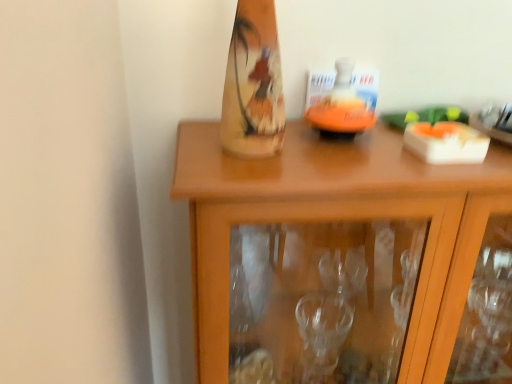
What is the approximate height of wooden cabinet at center?

wooden cabinet at center is 76.45 centimeters in height.

Locate an element on the screen. wooden cabinet at center is located at coordinates (339, 220).

What do you see at coordinates (339, 220) in the screenshot? I see `wooden cabinet at center` at bounding box center [339, 220].

Find the location of `orange matte candle holder at center`. orange matte candle holder at center is located at coordinates (341, 107).

This screenshot has width=512, height=384. What do you see at coordinates (341, 107) in the screenshot?
I see `orange matte candle holder at center` at bounding box center [341, 107].

Locate an element on the screen. The height and width of the screenshot is (384, 512). wooden cabinet at center is located at coordinates (339, 220).

Considering the relative positions of orange matte candle holder at center and wooden cabinet at center in the image provided, is orange matte candle holder at center to the right of wooden cabinet at center from the viewer's perspective?

Incorrect, orange matte candle holder at center is not on the right side of wooden cabinet at center.

From the picture: Which object is closer to the camera, orange matte candle holder at center or wooden cabinet at center?

wooden cabinet at center.

Considering the points (333, 103) and (410, 190), which point is in front, point (333, 103) or point (410, 190)?

The point (410, 190) is closer.

From the image's perspective, is orange matte candle holder at center above or below wooden cabinet at center?

Clearly, from the image's perspective, orange matte candle holder at center is above wooden cabinet at center.

From a real-world perspective, relative to wooden cabinet at center, is orange matte candle holder at center vertically above or below?

orange matte candle holder at center is situated higher than wooden cabinet at center in the real world.

Considering the relative sizes of orange matte candle holder at center and wooden cabinet at center in the image provided, is orange matte candle holder at center wider than wooden cabinet at center?

Incorrect, the width of orange matte candle holder at center does not surpass that of wooden cabinet at center.

Considering the sizes of orange matte candle holder at center and wooden cabinet at center in the image, is orange matte candle holder at center taller or shorter than wooden cabinet at center?

Clearly, orange matte candle holder at center is shorter compared to wooden cabinet at center.

Can you confirm if orange matte candle holder at center is bigger than wooden cabinet at center?

Incorrect, orange matte candle holder at center is not larger than wooden cabinet at center.

Based on the photo, is orange matte candle holder at center inside the boundaries of wooden cabinet at center, or outside?

orange matte candle holder at center exists outside the volume of wooden cabinet at center.

Is orange matte candle holder at center in contact with wooden cabinet at center?

orange matte candle holder at center and wooden cabinet at center are not in contact.

Is orange matte candle holder at center facing towards wooden cabinet at center?

No, orange matte candle holder at center is not oriented towards wooden cabinet at center.

How many degrees apart are the facing directions of orange matte candle holder at center and wooden cabinet at center?

orange matte candle holder at center and wooden cabinet at center are facing 0.000324 degrees away from each other.

Find the location of `cabinetry on the right of orange matte candle holder at center`. cabinetry on the right of orange matte candle holder at center is located at coordinates pos(339,220).

Looking at this image, is wooden cabinet at center to the left of orange matte candle holder at center from the viewer's perspective?

No, wooden cabinet at center is not to the left of orange matte candle holder at center.

Relative to orange matte candle holder at center, is wooden cabinet at center in front or behind?

wooden cabinet at center is in front of orange matte candle holder at center.

Is point (212, 219) closer to viewer compared to point (368, 118)?

Yes, point (212, 219) is in front of point (368, 118).

From the image's perspective, which one is positioned lower, wooden cabinet at center or orange matte candle holder at center?

wooden cabinet at center, from the image's perspective.

From a real-world perspective, who is located lower, wooden cabinet at center or orange matte candle holder at center?

wooden cabinet at center, from a real-world perspective.

Which of these two, wooden cabinet at center or orange matte candle holder at center, is wider?

With larger width is wooden cabinet at center.

Between wooden cabinet at center and orange matte candle holder at center, which one has more height?

Standing taller between the two is wooden cabinet at center.

Who is bigger, wooden cabinet at center or orange matte candle holder at center?

With larger size is wooden cabinet at center.

Is wooden cabinet at center not within orange matte candle holder at center?

Indeed, wooden cabinet at center is completely outside orange matte candle holder at center.

Are wooden cabinet at center and orange matte candle holder at center making contact?

No.

From the picture: Is wooden cabinet at center oriented away from orange matte candle holder at center?

No, wooden cabinet at center is not facing away from orange matte candle holder at center.

How different are the orientations of wooden cabinet at center and orange matte candle holder at center in degrees?

The facing directions of wooden cabinet at center and orange matte candle holder at center are 0.000324 degrees apart.

Identify the location of candle holder positioned vertically above the wooden cabinet at center (from a real-world perspective). (341, 107).

I want to click on cabinetry that appears on the right of orange matte candle holder at center, so click(339, 220).

In the image, there is a wooden cabinet at center. At what (x,y) coordinates should I click in order to perform the action: click on candle holder above it (from the image's perspective). Please return your answer as a coordinate pair (x, y). Looking at the image, I should click on (341, 107).